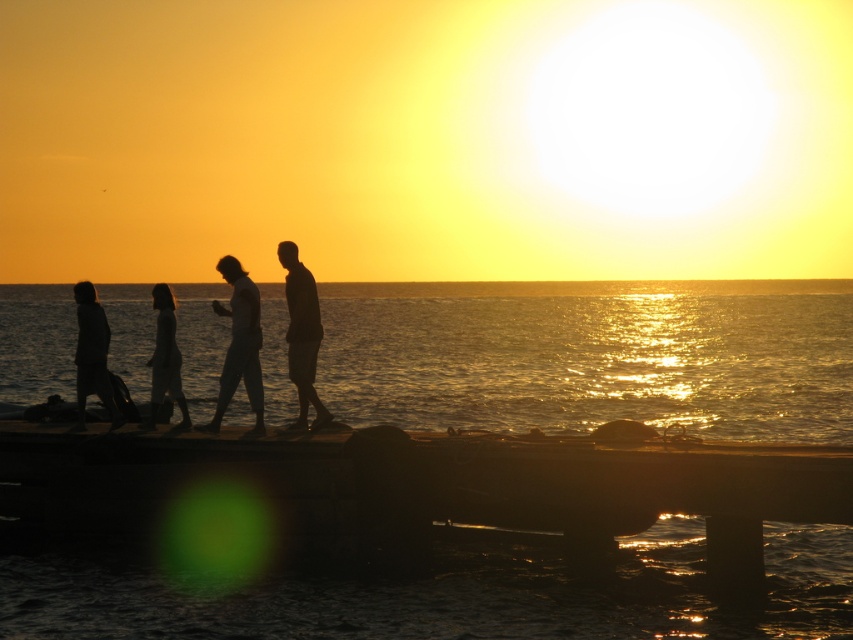
Question: Considering the real-world distances, which object is farthest from the silhouette human at center?

Choices:
 (A) silhouette figure at center
 (B) silhouette dress at left

Answer: (B)

Question: Does silhouette dress at left come behind silhouette dress at center?

Choices:
 (A) yes
 (B) no

Answer: (B)

Question: Does silhouette human at center have a lesser width compared to silhouette dress at center?

Choices:
 (A) yes
 (B) no

Answer: (B)

Question: Which object appears farthest from the camera in this image?

Choices:
 (A) smooth concrete dock at center
 (B) silhouette dress at left

Answer: (B)

Question: Which point is farther from the camera taking this photo?

Choices:
 (A) (283, 250)
 (B) (78, 346)

Answer: (B)

Question: Does reflective golden water at center appear on the left side of silhouette dress at left?

Choices:
 (A) yes
 (B) no

Answer: (A)